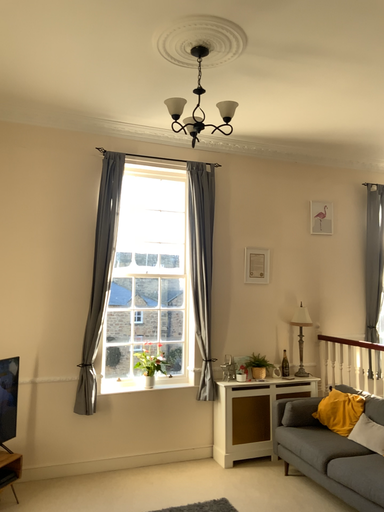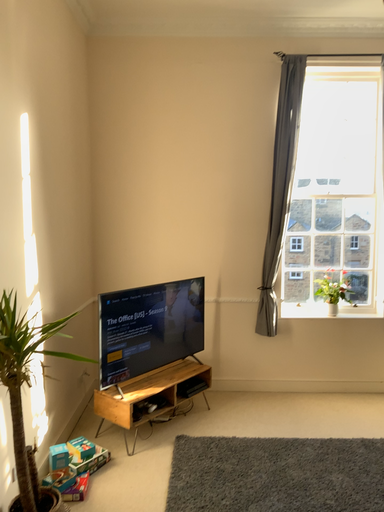
Question: Which way did the camera rotate in the video?

Choices:
 (A) rotated upward
 (B) rotated downward

Answer: (B)